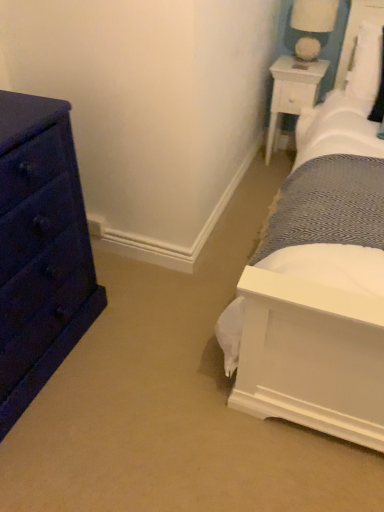
Question: Does matte dark blue dresser at left turn towards white fabric-covered lampshade at upper right?

Choices:
 (A) no
 (B) yes

Answer: (A)

Question: Is the depth of matte dark blue dresser at left less than that of white fabric-covered lampshade at upper right?

Choices:
 (A) no
 (B) yes

Answer: (B)

Question: From a real-world perspective, is matte dark blue dresser at left under white fabric-covered lampshade at upper right?

Choices:
 (A) no
 (B) yes

Answer: (B)

Question: From the image's perspective, is matte dark blue dresser at left on white fabric-covered lampshade at upper right?

Choices:
 (A) yes
 (B) no

Answer: (B)

Question: Considering the relative positions of matte dark blue dresser at left and white fabric-covered lampshade at upper right in the image provided, is matte dark blue dresser at left to the left of white fabric-covered lampshade at upper right from the viewer's perspective?

Choices:
 (A) yes
 (B) no

Answer: (A)

Question: Can you confirm if matte dark blue dresser at left is taller than white fabric-covered lampshade at upper right?

Choices:
 (A) yes
 (B) no

Answer: (A)

Question: From the image's perspective, is white wood nightstand at upper right located beneath matte dark blue dresser at left?

Choices:
 (A) no
 (B) yes

Answer: (A)

Question: Is white wood nightstand at upper right positioned far away from matte dark blue dresser at left?

Choices:
 (A) no
 (B) yes

Answer: (B)

Question: Could you tell me if white wood nightstand at upper right is facing matte dark blue dresser at left?

Choices:
 (A) yes
 (B) no

Answer: (B)

Question: Does white wood nightstand at upper right contain matte dark blue dresser at left?

Choices:
 (A) yes
 (B) no

Answer: (B)

Question: From the image's perspective, does white wood nightstand at upper right appear higher than matte dark blue dresser at left?

Choices:
 (A) yes
 (B) no

Answer: (A)

Question: Does white wood nightstand at upper right have a lesser width compared to matte dark blue dresser at left?

Choices:
 (A) no
 (B) yes

Answer: (B)

Question: Is white wood nightstand at upper right further to the viewer compared to white fabric-covered lampshade at upper right?

Choices:
 (A) no
 (B) yes

Answer: (B)